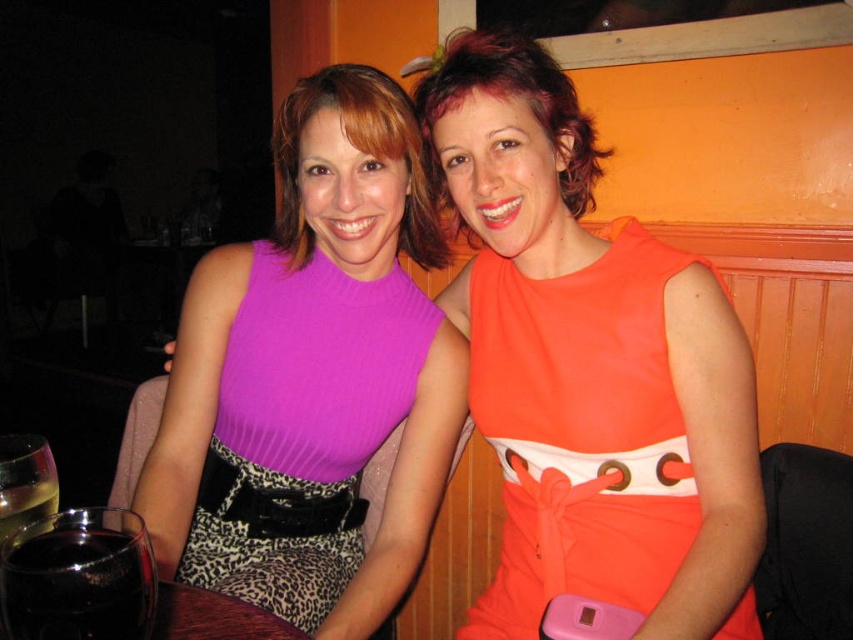
Question: Which point is closer to the camera taking this photo?

Choices:
 (A) (309, 490)
 (B) (99, 609)
 (C) (4, 500)

Answer: (B)

Question: Which object is the closest to the orange satin dress at center?

Choices:
 (A) translucent glass wine at lower left
 (B) purple ribbed fabric dress at center
 (C) leopard print fabric belt at lower center
 (D) translucent glass at lower left

Answer: (B)

Question: Can you confirm if orange satin dress at center is positioned to the right of translucent glass wine at lower left?

Choices:
 (A) yes
 (B) no

Answer: (A)

Question: From the image, what is the correct spatial relationship of leopard print fabric belt at lower center in relation to translucent glass at lower left?

Choices:
 (A) below
 (B) above

Answer: (A)

Question: Can you confirm if translucent glass wine at lower left is thinner than leopard print fabric belt at lower center?

Choices:
 (A) no
 (B) yes

Answer: (B)

Question: Considering the real-world distances, which object is farthest from the leopard print fabric belt at lower center?

Choices:
 (A) translucent glass at lower left
 (B) translucent glass wine at lower left

Answer: (B)